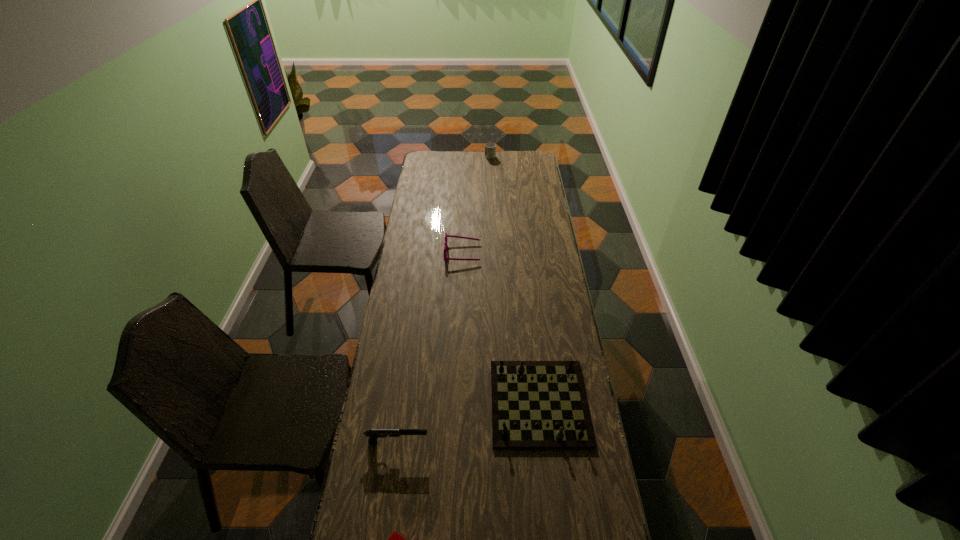
Locate an element on the screen. The width and height of the screenshot is (960, 540). vacant area between the gun and the second farthest object is located at coordinates (430, 347).

Identify which object is the second closest to the spectacles. Please provide its 2D coordinates. Your answer should be formatted as a tuple, i.e. [(x, y)], where the tuple contains the x and y coordinates of a point satisfying the conditions above.

[(490, 148)]

Find the location of a particular element. The image size is (960, 540). object that is the second nearest to the Lego is located at coordinates (535, 404).

What are the coordinates of `blank area in the image that satisfies the following two spatial constraints: 1. on the board of the chessboard; 2. at the muzzle end of the gun` in the screenshot? It's located at (543, 442).